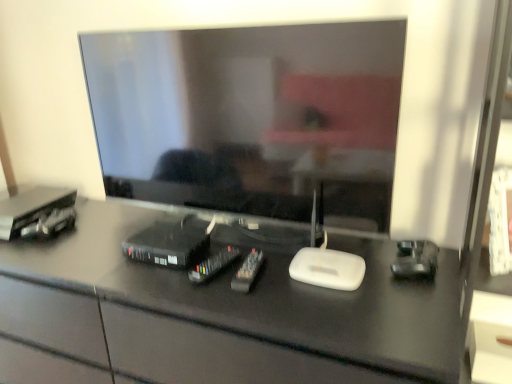
This screenshot has height=384, width=512. In order to click on blank area to the left of black plastic dvd player at lower left, positioned as the 2th equipment in left-to-right order in this screenshot , I will do `click(97, 259)`.